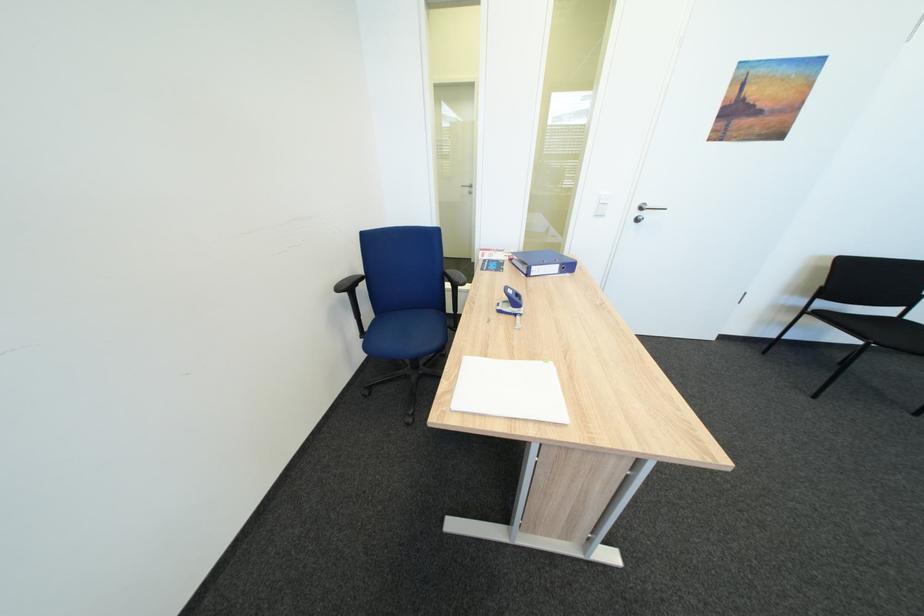
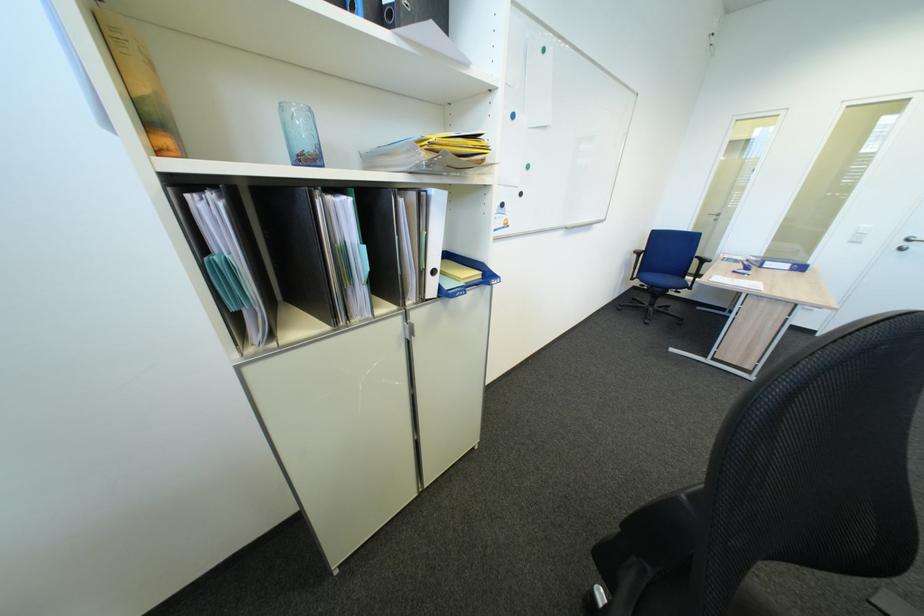
The point at (543, 269) is marked in the first image. Where is the corresponding point in the second image?

(776, 264)